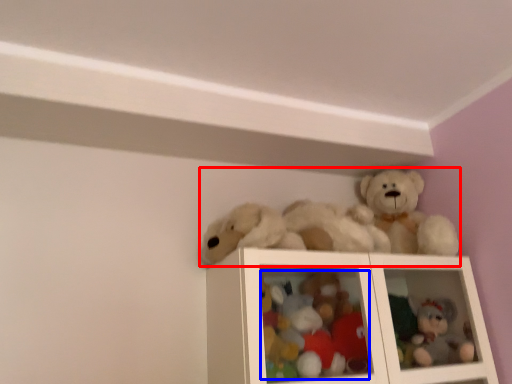
Question: Which object is closer to the camera taking this photo, toy (highlighted by a red box) or toy (highlighted by a blue box)?

Choices:
 (A) toy
 (B) toy

Answer: (A)